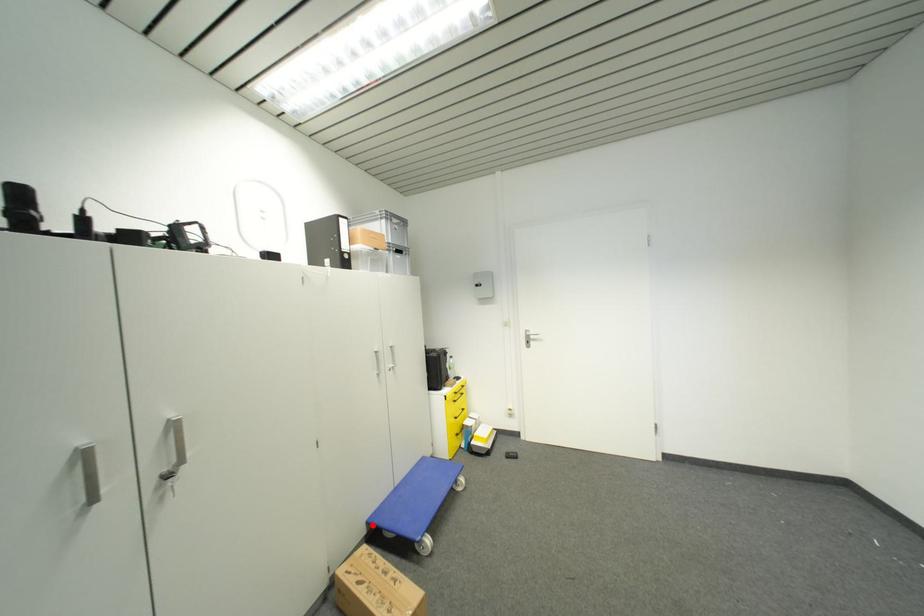
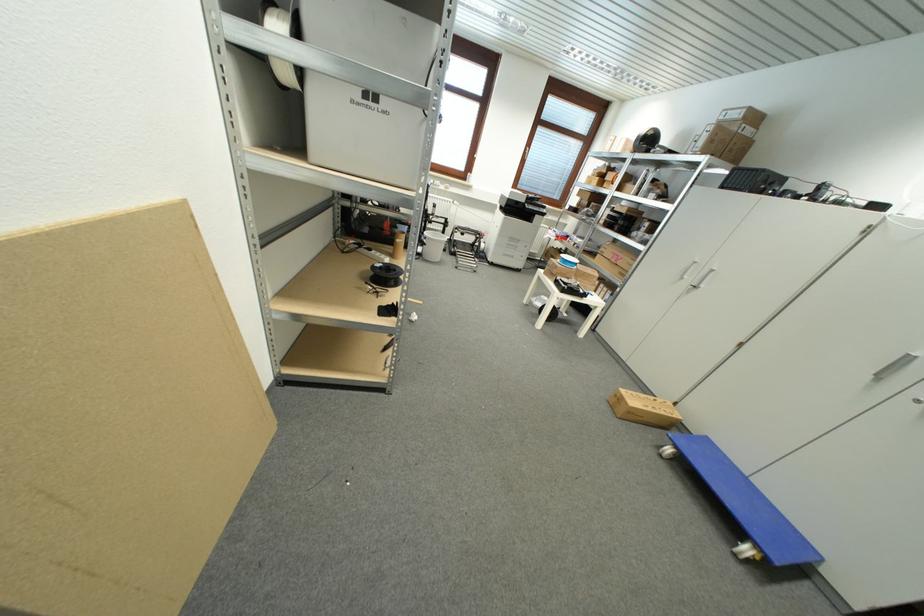
Locate, in the second image, the point that corresponds to the highlighted location in the first image.

(711, 440)